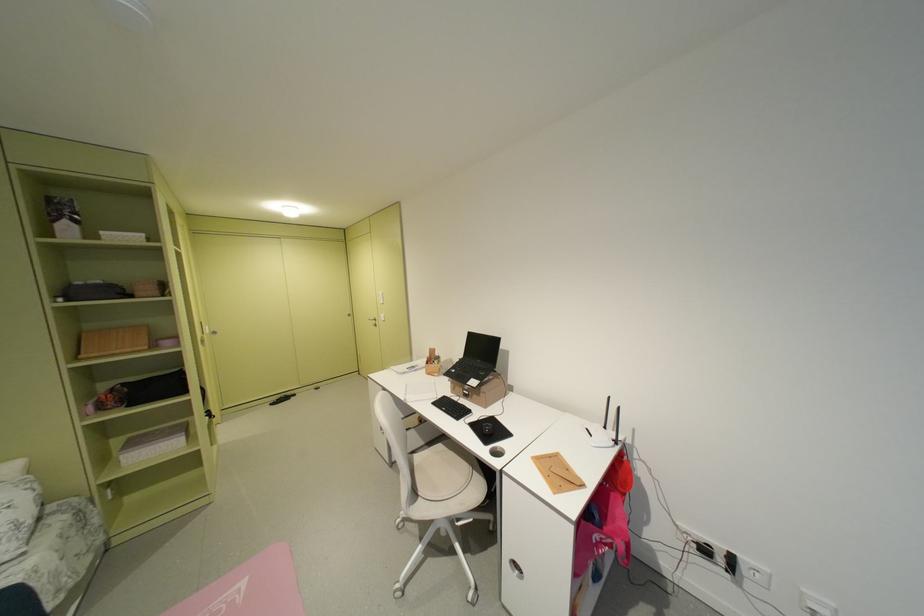
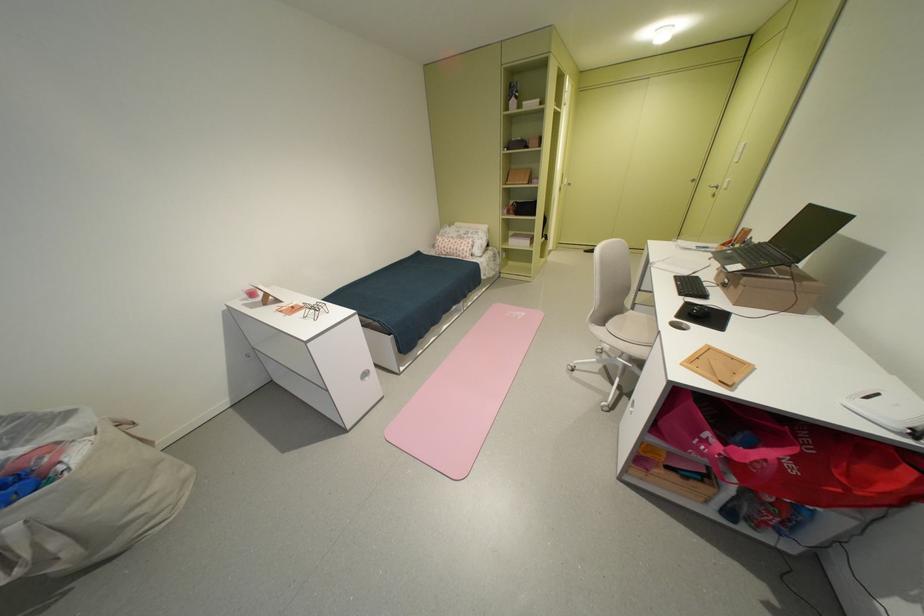
The point at (383, 323) is marked in the first image. Where is the corresponding point in the second image?

(724, 190)